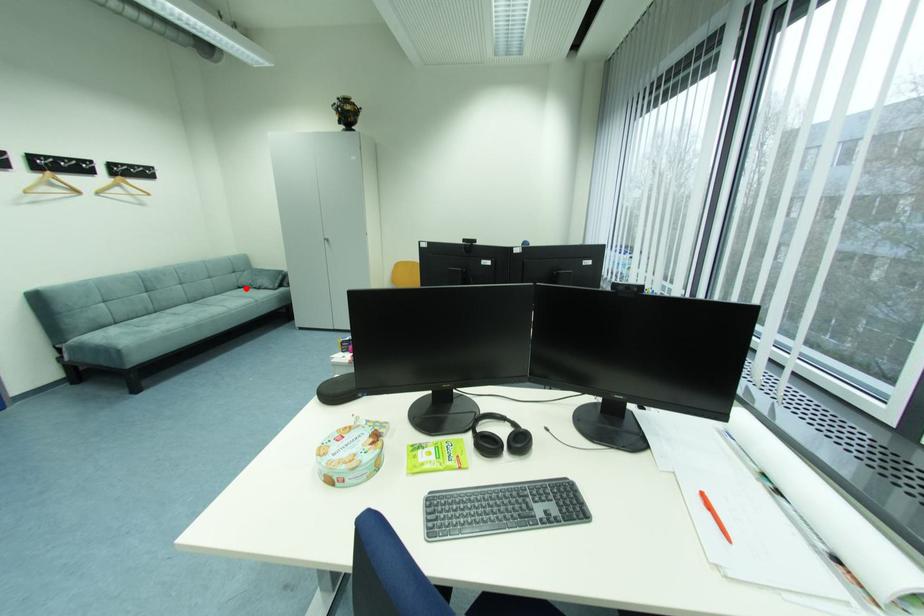
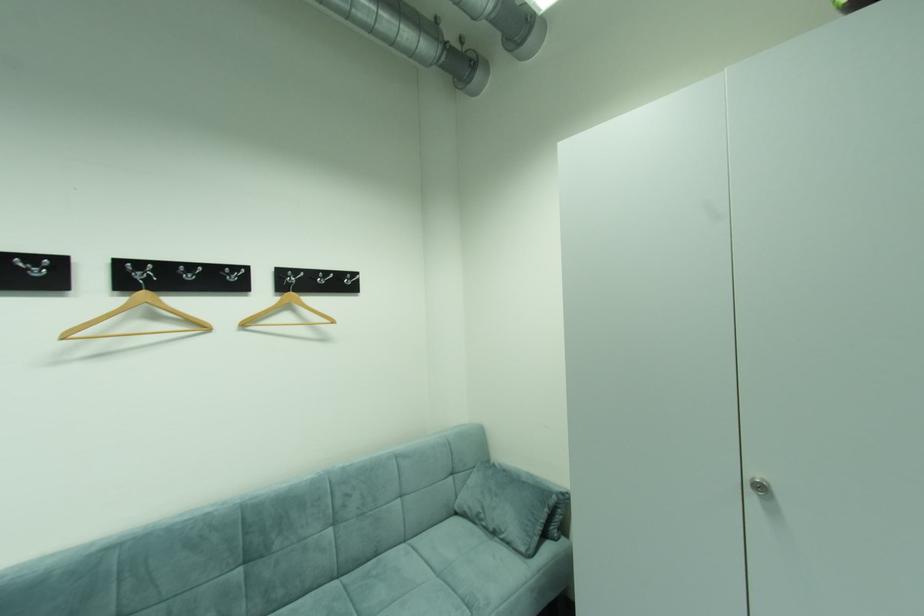
Question: A red point is marked in image1. In image2, is the corresponding 3D point closer to the camera or farther? Reply with the corresponding letter.

Choices:
 (A) The corresponding 3D point is closer.
 (B) The corresponding 3D point is farther.

Answer: (B)